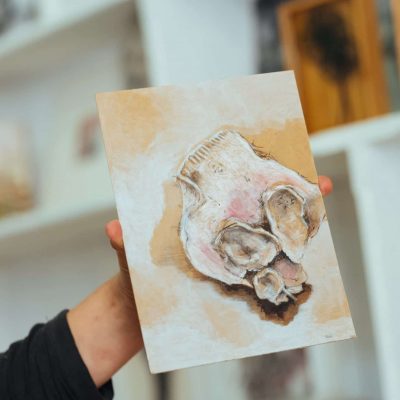
Where is `fabric`? The height and width of the screenshot is (400, 400). fabric is located at coordinates (224, 169).